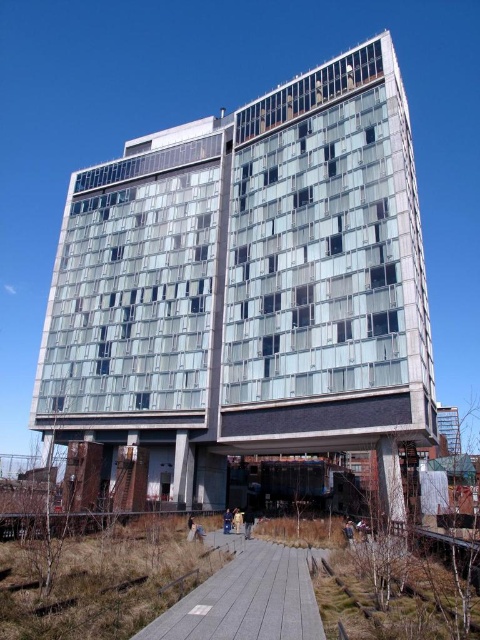
Between point (330, 260) and point (257, 602), which one is positioned behind?

Point (330, 260)

Measure the distance between point (x=253, y=136) and camera.

Point (x=253, y=136) is 202.87 feet from camera.

This screenshot has height=640, width=480. I want to click on glassy concrete building at center, so click(x=249, y=288).